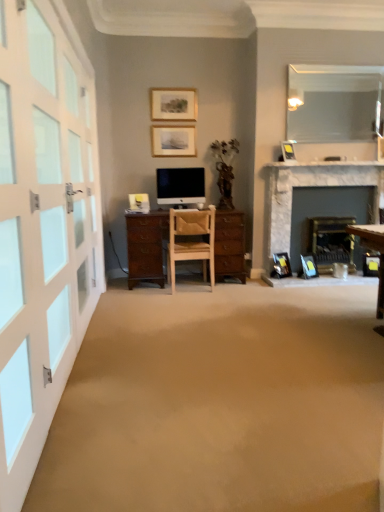
You are a GUI agent. You are given a task and a screenshot of the screen. Output one action in this format:
    pyautogui.click(x=<x>, y=<y>)
    Task: Click on the free point below matte wooden picture frame at upper center, which is counted as the 1th picture frame, starting from the left (from a real-world perspective)
    Image resolution: width=384 pixels, height=512 pixels.
    Given the screenshot: What is the action you would take?
    pyautogui.click(x=182, y=119)